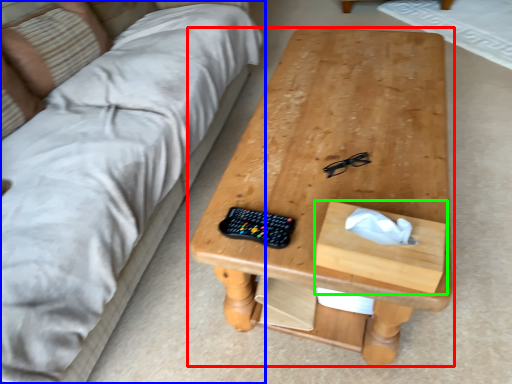
Question: Based on their relative distances, which object is nearer to table (highlighted by a red box)? Choose from studio couch (highlighted by a blue box) and drawer (highlighted by a green box).

Choices:
 (A) studio couch
 (B) drawer

Answer: (B)